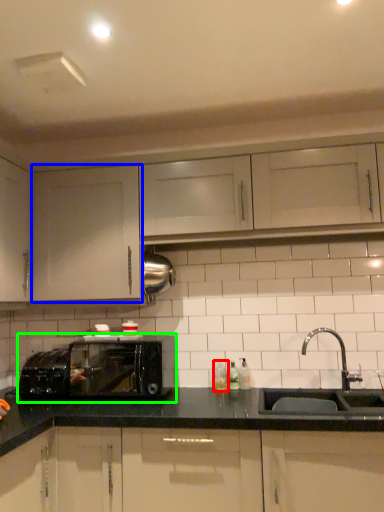
Question: Which is nearer to the bottle (highlighted by a red box)? cabinetry (highlighted by a blue box) or microwave oven (highlighted by a green box).

Choices:
 (A) cabinetry
 (B) microwave oven

Answer: (B)